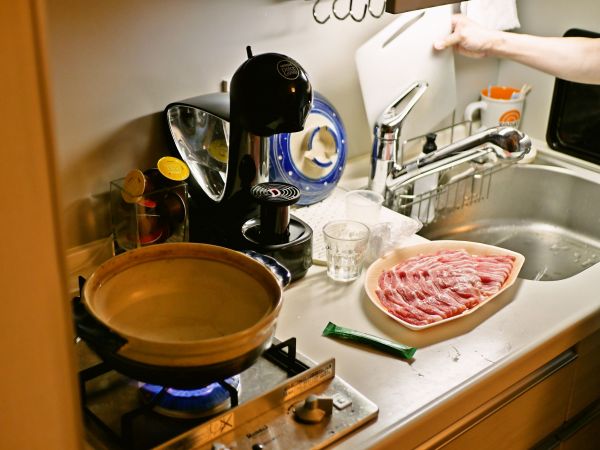
Where is `water in sink`? The image size is (600, 450). water in sink is located at coordinates point(572,255).